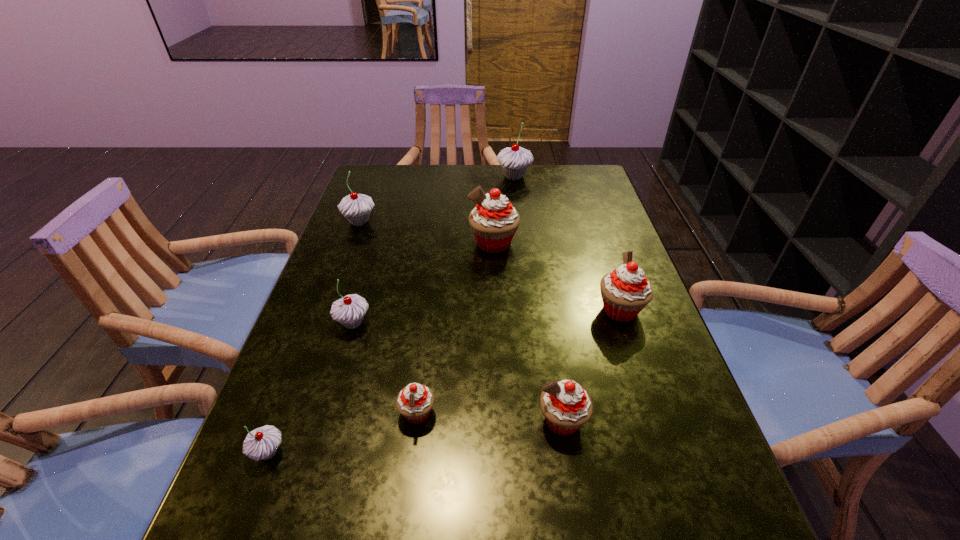
Locate an element on the screen. Image resolution: width=960 pixels, height=540 pixels. pink cupcake that can be found as the closest to the nearest gray cupcake is located at coordinates (415, 401).

Locate an element on the screen. free space that satisfies the following two spatial constraints: 1. on the front side of the second nearest gray cupcake; 2. on the left side of the second smallest pink cupcake is located at coordinates (324, 421).